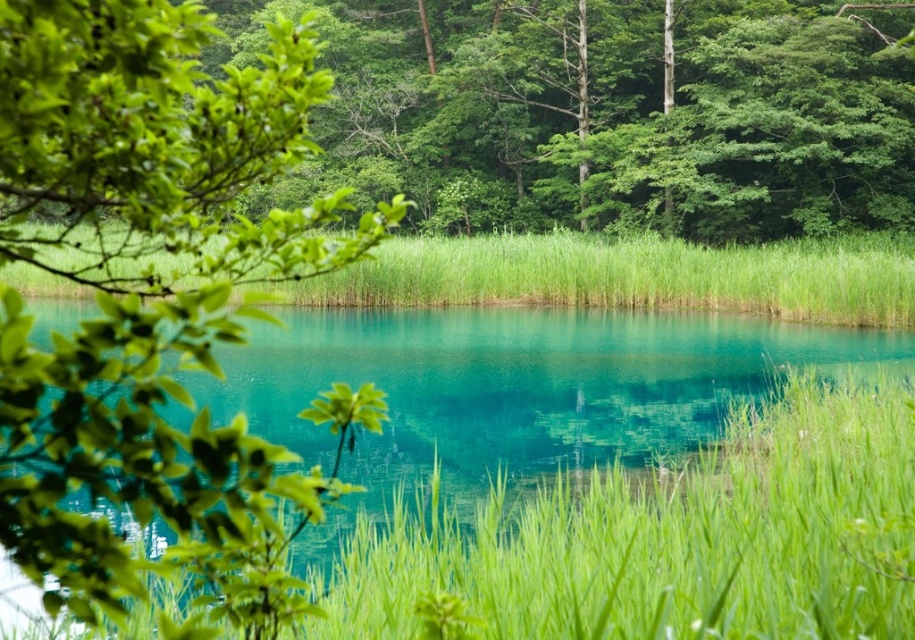
Question: Which object is closer to the camera taking this photo?

Choices:
 (A) green grass at center
 (B) green leafy tree at upper left

Answer: (B)

Question: Which point appears closest to the camera in this image?

Choices:
 (A) (397, 588)
 (B) (912, 273)

Answer: (A)

Question: Does green leafy tree at upper left have a smaller size compared to green grass at center?

Choices:
 (A) yes
 (B) no

Answer: (B)

Question: Does green leafy tree at upper left have a smaller size compared to green grassy at center?

Choices:
 (A) no
 (B) yes

Answer: (A)

Question: Does green grass at center lie in front of green grassy at center?

Choices:
 (A) no
 (B) yes

Answer: (B)

Question: Which point is farther to the camera?

Choices:
 (A) click(x=481, y=516)
 (B) click(x=203, y=12)
 (C) click(x=655, y=285)

Answer: (B)